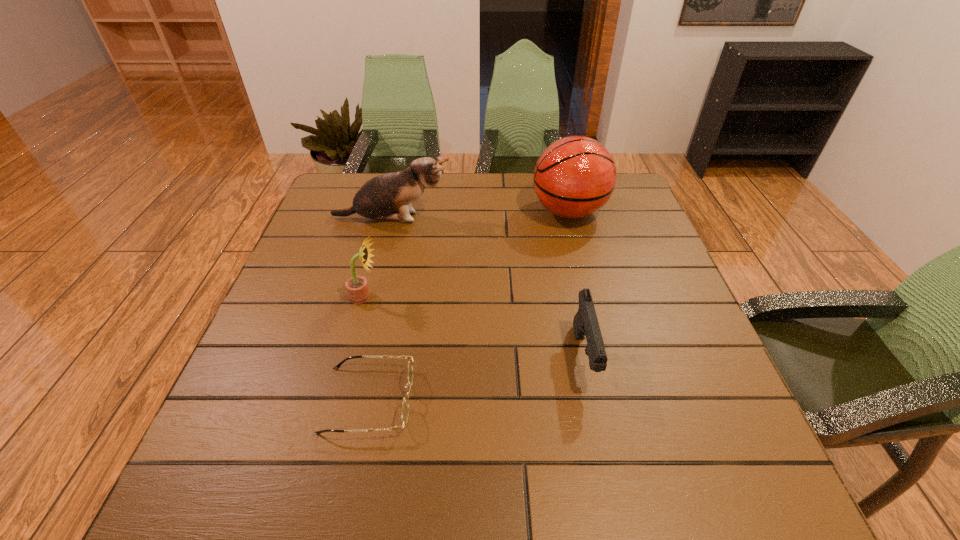
Where is `free space located at the barrel of the pistol`? The height and width of the screenshot is (540, 960). free space located at the barrel of the pistol is located at coordinates (612, 487).

The image size is (960, 540). Find the location of `blank area located on the lenses of the shortest object`. blank area located on the lenses of the shortest object is located at coordinates (604, 400).

Image resolution: width=960 pixels, height=540 pixels. Find the location of `basketball positioned at the far edge`. basketball positioned at the far edge is located at coordinates (574, 177).

At what (x,y) coordinates should I click in order to perform the action: click on cat that is positioned at the far edge. Please return your answer as a coordinate pair (x, y). The width and height of the screenshot is (960, 540). Looking at the image, I should click on (388, 196).

At what (x,y) coordinates should I click in order to perform the action: click on object present at the left edge. Please return your answer as a coordinate pair (x, y). The width and height of the screenshot is (960, 540). Looking at the image, I should click on (388, 196).

Where is `object that is at the right edge`? object that is at the right edge is located at coordinates (574, 177).

Where is `object that is at the far left corner`? object that is at the far left corner is located at coordinates (388, 196).

Where is `object that is at the far right corner`? This screenshot has width=960, height=540. object that is at the far right corner is located at coordinates (574, 177).

What are the coordinates of `vacant point at the far edge` in the screenshot? It's located at (438, 190).

Where is `vacant region at the left edge of the desktop`? The height and width of the screenshot is (540, 960). vacant region at the left edge of the desktop is located at coordinates (280, 404).